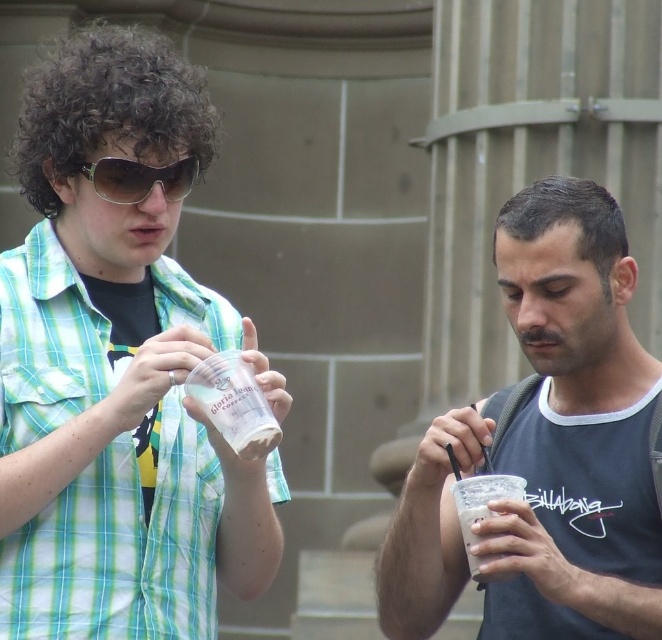
Question: Which object is closer to the camera taking this photo?

Choices:
 (A) sunglasses at upper left
 (B) white paper cup at center

Answer: (B)

Question: Considering the relative positions of matte plastic cup at right and white frosted cup at right in the image provided, where is matte plastic cup at right located with respect to white frosted cup at right?

Choices:
 (A) below
 (B) above

Answer: (B)

Question: Does translucent plastic cup at center appear on the left side of white frosted cup at right?

Choices:
 (A) no
 (B) yes

Answer: (B)

Question: Which point is farther from the camera taking this photo?

Choices:
 (A) (x=643, y=412)
 (B) (x=277, y=376)
 (C) (x=238, y=365)

Answer: (A)

Question: Does white paper cup at center have a smaller size compared to sunglasses at upper left?

Choices:
 (A) yes
 (B) no

Answer: (B)

Question: Which object appears farthest from the camera in this image?

Choices:
 (A) white frosted cup at right
 (B) matte gray tank top at right
 (C) sunglasses at upper left

Answer: (B)